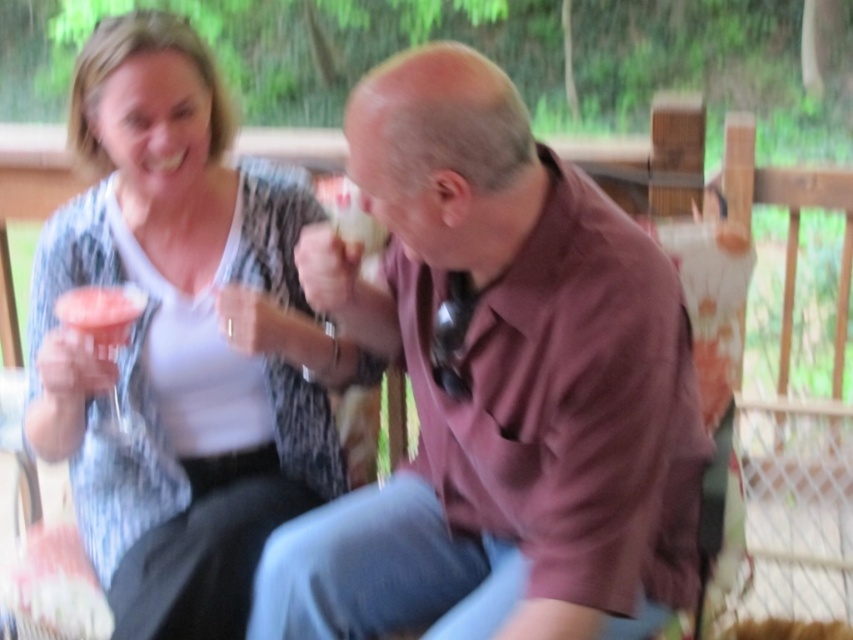
Question: Can you confirm if brown matte shirt at center is thinner than matte white blouse at upper left?

Choices:
 (A) yes
 (B) no

Answer: (B)

Question: Can you confirm if brown matte shirt at center is bigger than matte white blouse at upper left?

Choices:
 (A) yes
 (B) no

Answer: (A)

Question: Does brown matte shirt at center have a greater width compared to matte white blouse at upper left?

Choices:
 (A) no
 (B) yes

Answer: (B)